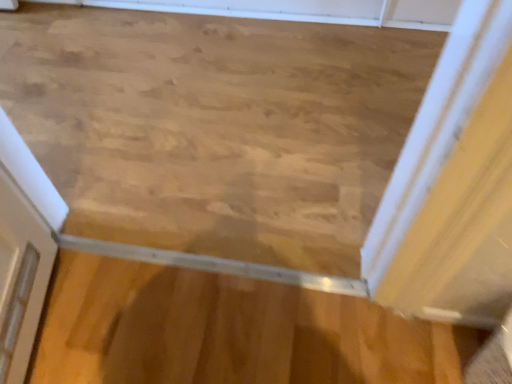
The width and height of the screenshot is (512, 384). What do you see at coordinates (227, 331) in the screenshot? I see `natural wood plywood at center` at bounding box center [227, 331].

In order to face natural wood plywood at center, should I rotate leftwards or rightwards?

A 2.360 degree turn to the left will do.

In order to click on natural wood plywood at center in this screenshot , I will do `click(227, 331)`.

In order to click on natural wood plywood at center in this screenshot , I will do [227, 331].